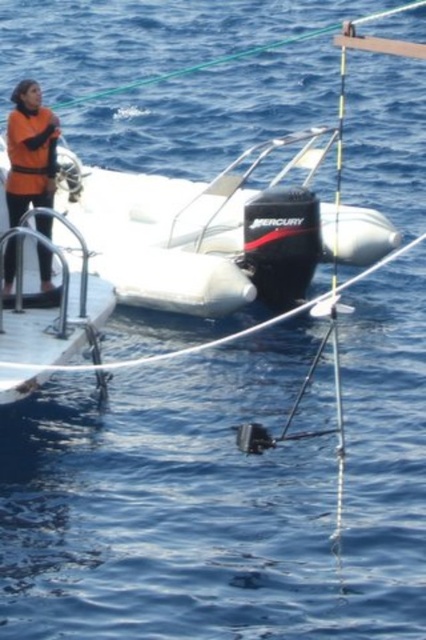
Question: Based on their relative distances, which object is nearer to the orange matte life jacket at left?

Choices:
 (A) white rubber boat at center
 (B) orange fleece jacket at upper left

Answer: (B)

Question: Is white rubber boat at center below orange fleece jacket at upper left?

Choices:
 (A) yes
 (B) no

Answer: (B)

Question: Which object is closer to the camera taking this photo?

Choices:
 (A) orange fleece jacket at upper left
 (B) white rubber boat at center
 (C) orange matte life jacket at left

Answer: (A)

Question: Does white rubber boat at center lie in front of orange matte life jacket at left?

Choices:
 (A) yes
 (B) no

Answer: (B)

Question: Is white rubber boat at center thinner than orange fleece jacket at upper left?

Choices:
 (A) no
 (B) yes

Answer: (A)

Question: Which object is positioned closest to the white rubber boat at center?

Choices:
 (A) orange matte life jacket at left
 (B) orange fleece jacket at upper left

Answer: (A)